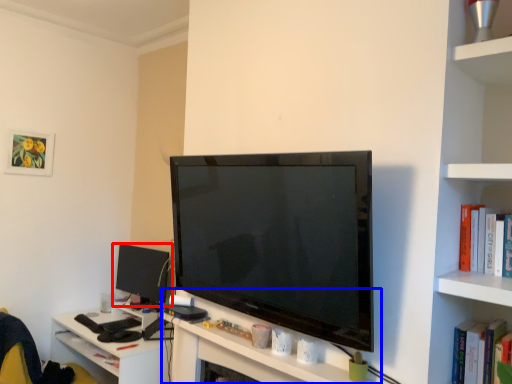
Question: Which point is closer to the camera, computer monitor (highlighted by a red box) or computer desk (highlighted by a blue box)?

Choices:
 (A) computer monitor
 (B) computer desk

Answer: (B)